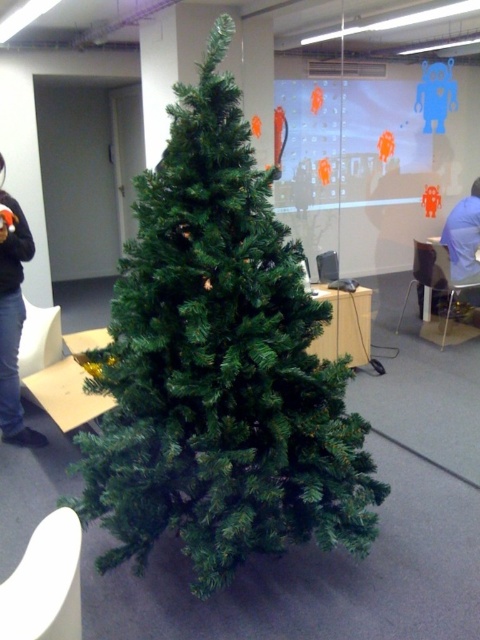
You are organizing a charity clothing drive and need to sort items by size. You have a black sweater at left and a blue fabric shirt at right. Which item should you place in the larger size bin?

The blue fabric shirt at right should be placed in the larger size bin because its width is greater than the black sweater at left.

Looking at this image, where is the green matte christmas tree at center located in the image?

The green matte christmas tree at center is located at point coordinates of approximately 0.572 on the x axis and 0.456 on the y axis.

Please describe the object located at point (218, 365) in the image.

The object at point (218, 365) is the green matte christmas tree at center.